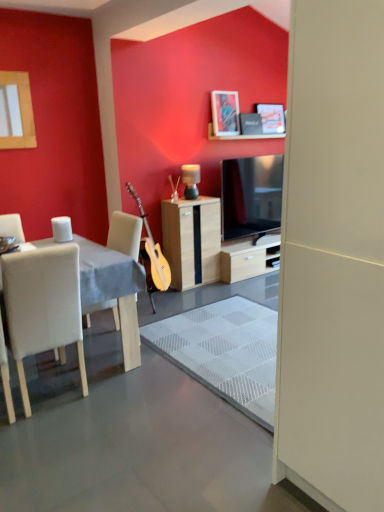
At what (x,y) coordinates should I click in order to perform the action: click on free spot below matte black picture frame at upper center, the 2th picture frame viewed from the front (from a real-world perspective). Please return your answer as a coordinate pair (x, y). Looking at the image, I should click on (266, 135).